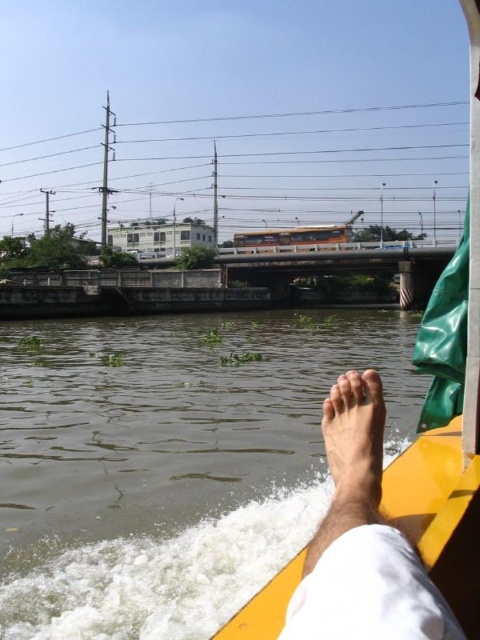
You are on a boat ride and notice your skinny barefoot at lower center and the brown murky water at lower left. Which object is closer to you from your current position?

The skinny barefoot at lower center is closer to you because it is in front of the brown murky water at lower left.